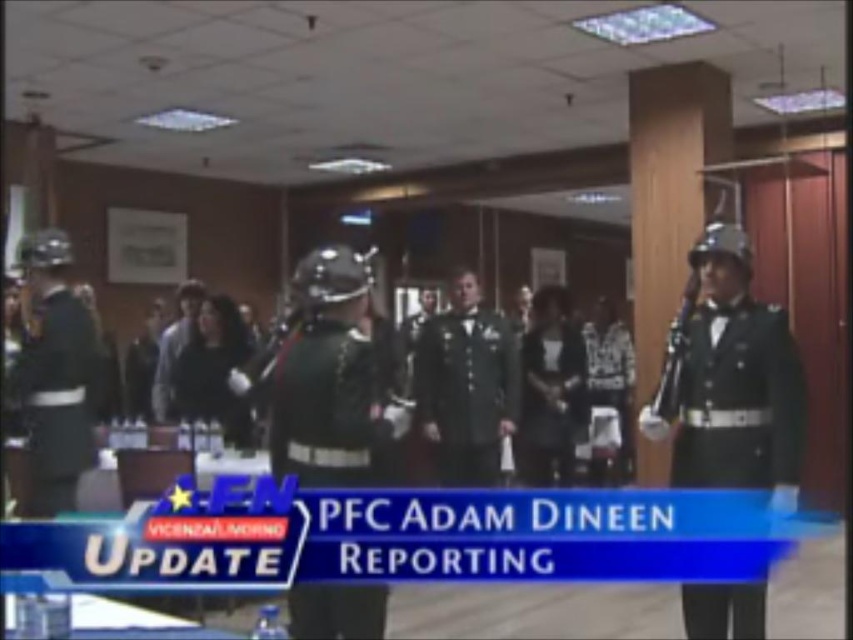
In the scene shown: Can you confirm if dark green fabric uniform at center is positioned to the left of matte black uniform at center?

Correct, you'll find dark green fabric uniform at center to the left of matte black uniform at center.

The height and width of the screenshot is (640, 853). What do you see at coordinates (466, 392) in the screenshot?
I see `dark green fabric uniform at center` at bounding box center [466, 392].

Does point (451, 362) come closer to viewer compared to point (627, 369)?

Yes, it is in front of point (627, 369).

You are a GUI agent. You are given a task and a screenshot of the screen. Output one action in this format:
    pyautogui.click(x=<x>, y=<y>)
    Task: Click on the dark green fabric uniform at center
    
    Given the screenshot: What is the action you would take?
    pyautogui.click(x=466, y=392)

Where is `black fabric uniform at center`? This screenshot has width=853, height=640. black fabric uniform at center is located at coordinates (550, 400).

Where is `black fabric uniform at center`? The height and width of the screenshot is (640, 853). black fabric uniform at center is located at coordinates (550, 400).

Find the location of `matte black uniform at left`. matte black uniform at left is located at coordinates (57, 396).

Which is behind, point (88, 467) or point (161, 376)?

The point (161, 376) is more distant.

This screenshot has width=853, height=640. Describe the element at coordinates (57, 396) in the screenshot. I see `matte black uniform at left` at that location.

The image size is (853, 640). I want to click on matte black uniform at left, so click(x=57, y=396).